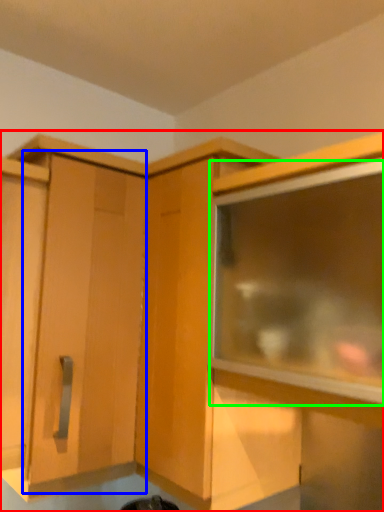
Question: Which is nearer to the cabinetry (highlighted by a red box)? cabinetry (highlighted by a blue box) or window (highlighted by a green box).

Choices:
 (A) cabinetry
 (B) window

Answer: (A)